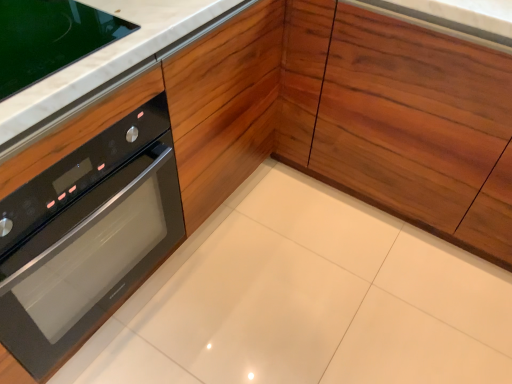
Question: Should I look upward or downward to see wooden at center?

Choices:
 (A) down
 (B) up

Answer: (B)

Question: Does wooden at center have a greater height compared to black glass oven at left?

Choices:
 (A) no
 (B) yes

Answer: (B)

Question: Does wooden at center have a larger size compared to black glass oven at left?

Choices:
 (A) yes
 (B) no

Answer: (A)

Question: Is wooden at center at the left side of black glass oven at left?

Choices:
 (A) yes
 (B) no

Answer: (B)

Question: Is wooden at center aimed at black glass oven at left?

Choices:
 (A) no
 (B) yes

Answer: (B)

Question: Does wooden at center have a lesser height compared to black glass oven at left?

Choices:
 (A) no
 (B) yes

Answer: (A)

Question: From the image's perspective, is wooden at center above black glass oven at left?

Choices:
 (A) yes
 (B) no

Answer: (A)

Question: Is wooden at center positioned beyond the bounds of white marble countertop at upper left?

Choices:
 (A) yes
 (B) no

Answer: (A)

Question: From a real-world perspective, is wooden at center physically above white marble countertop at upper left?

Choices:
 (A) yes
 (B) no

Answer: (B)

Question: Is wooden at center bigger than white marble countertop at upper left?

Choices:
 (A) yes
 (B) no

Answer: (A)

Question: Is white marble countertop at upper left located within wooden at center?

Choices:
 (A) yes
 (B) no

Answer: (B)

Question: Is wooden at center placed right next to white marble countertop at upper left?

Choices:
 (A) yes
 (B) no

Answer: (B)

Question: Would you say wooden at center is a long distance from white marble countertop at upper left?

Choices:
 (A) no
 (B) yes

Answer: (A)

Question: Can we say black glass oven at left lies outside wooden at center?

Choices:
 (A) no
 (B) yes

Answer: (B)